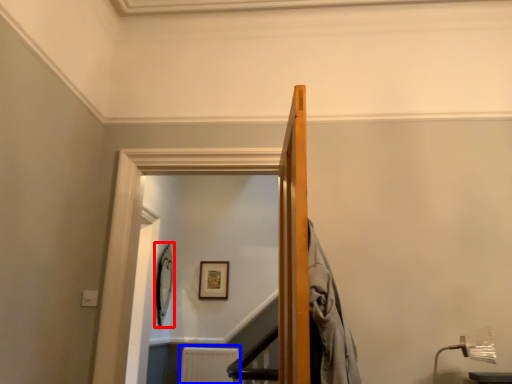
Question: Which object appears farthest to the camera in this image, picture frame (highlighted by a red box) or radiator (highlighted by a blue box)?

Choices:
 (A) picture frame
 (B) radiator

Answer: (B)